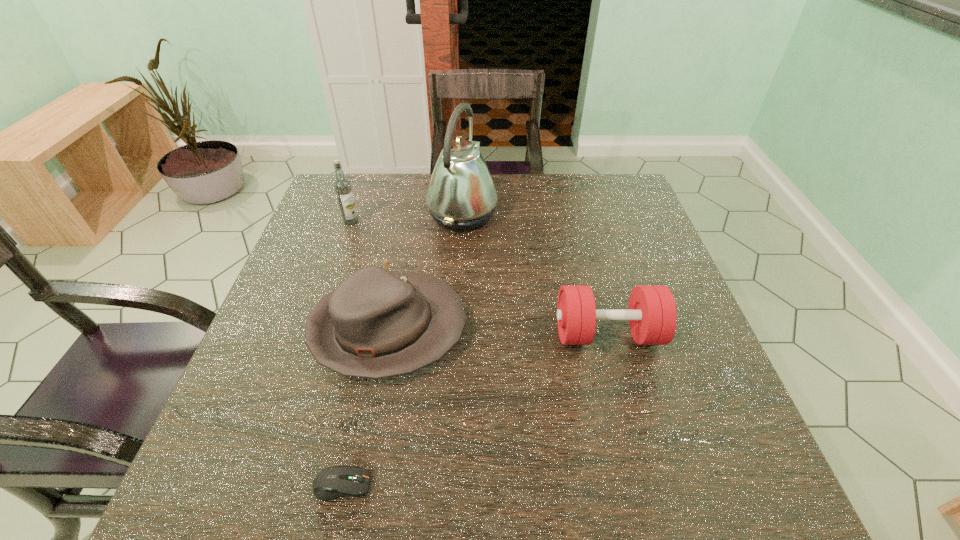
The image size is (960, 540). I want to click on blank region between the rightmost object and the hat, so click(x=498, y=332).

Identify the location of object that is the closest to the fourth shortest object. The width and height of the screenshot is (960, 540). (461, 195).

Identify which object is the third nearest to the hat. Please provide its 2D coordinates. Your answer should be formatted as a tuple, i.e. [(x, y)], where the tuple contains the x and y coordinates of a point satisfying the conditions above.

[(652, 315)]

Where is `free space in the image that satisfies the following two spatial constraints: 1. on the decorative side of the dumbbell; 2. on the right side of the hat`? free space in the image that satisfies the following two spatial constraints: 1. on the decorative side of the dumbbell; 2. on the right side of the hat is located at coordinates (387, 334).

At what (x,y) coordinates should I click in order to perform the action: click on vacant space that satisfies the following two spatial constraints: 1. on the decorative side of the hat; 2. on the left side of the rightmost object. Please return your answer as a coordinate pair (x, y). The image size is (960, 540). Looking at the image, I should click on (387, 334).

Find the location of a particular element. This screenshot has width=960, height=540. vacant region that satisfies the following two spatial constraints: 1. on the front side of the kettle; 2. on the button of the computer equipment is located at coordinates (449, 484).